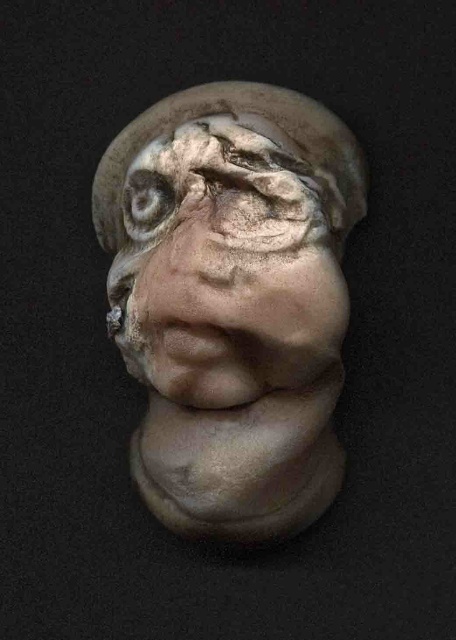
You are an art conservator examining the sculpture. You notice two points on the sculpture at coordinates point (x=110, y=172) and point (x=239, y=173). Which point is closer to the viewer?

Point (x=239, y=173) is closer to the viewer than point (x=110, y=172) because the description states that point (x=110, y=172) is behind point (x=239, y=173).

You are an art student analyzing the sculpture. You notice the matte clay bust at center and the matte clay eye at center. Which object is located higher in the image?

The matte clay eye at center is higher because the matte clay bust at center is positioned under it.

You are an art conservator working with a 19 cm long tool. You need to handle both the matte clay bust at center and the matte clay eye at center. Can you reach both objects with your tool without moving your position?

The matte clay bust at center is 18.89 centimeters away from the matte clay eye at center. Since your tool is 19 cm long, you can reach both objects as the distance between them is just under the tool length.